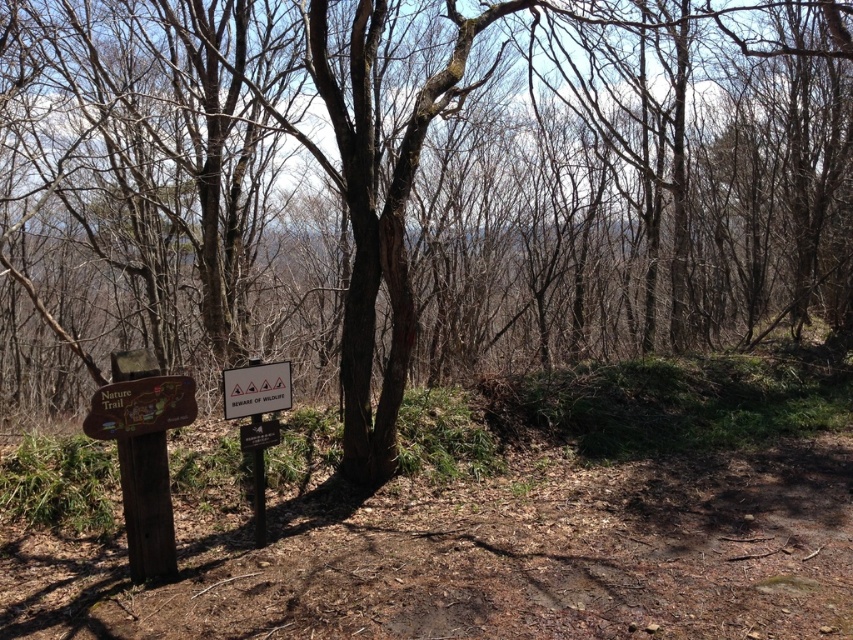
Between wooden sign at left and black plastic sign at lower center, which one appears on the left side from the viewer's perspective?

wooden sign at left is more to the left.

Does wooden sign at left have a lesser width compared to black plastic sign at lower center?

In fact, wooden sign at left might be wider than black plastic sign at lower center.

Who is more distant from viewer, (137, 424) or (251, 433)?

Positioned behind is point (251, 433).

Identify the location of wooden sign at left. (140, 406).

Who is positioned more to the right, brown wooden signpost at left or black plastic sign at lower center?

black plastic sign at lower center is more to the right.

Who is more distant from viewer, (154, 524) or (257, 429)?

The point (257, 429) is more distant.

Identify the location of brown wooden signpost at left. The image size is (853, 640). (148, 506).

Which is more to the right, brown wooden signpost at left or wooden sign at left?

wooden sign at left

Measure the distance between point [157,468] and camera.

Point [157,468] is 4.40 meters away from camera.

This screenshot has height=640, width=853. What do you see at coordinates (148, 506) in the screenshot? I see `brown wooden signpost at left` at bounding box center [148, 506].

The width and height of the screenshot is (853, 640). In order to click on brown wooden signpost at left in this screenshot , I will do `click(148, 506)`.